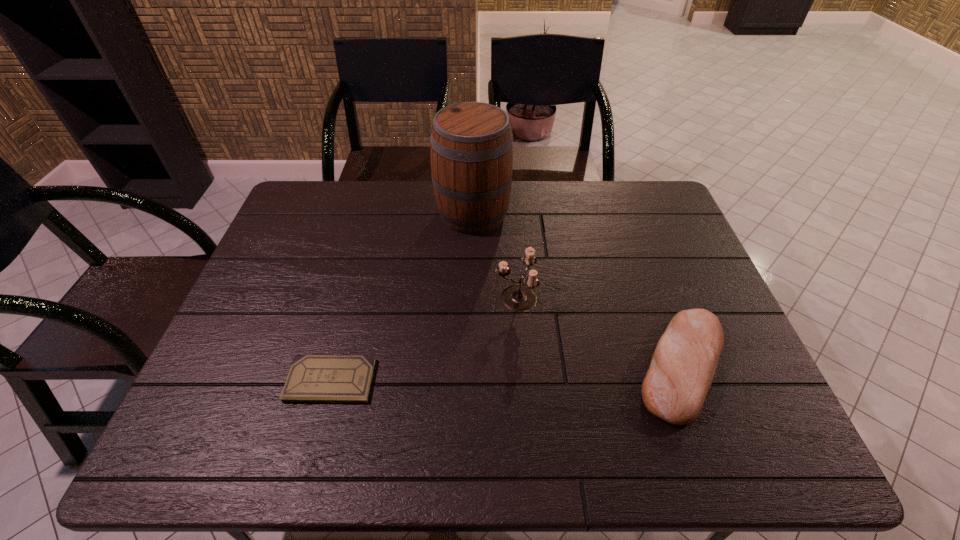
Find the location of a particular element. This screenshot has height=540, width=960. free space located on the back of the rightmost object is located at coordinates (655, 292).

I want to click on vacant space located 0.200m on the right of the leftmost object, so click(x=461, y=380).

Locate an element on the screen. object at the far edge is located at coordinates (471, 146).

At what (x,y) coordinates should I click in order to perform the action: click on object at the near edge. Please return your answer as a coordinate pair (x, y). Looking at the image, I should click on (683, 365).

You are a GUI agent. You are given a task and a screenshot of the screen. Output one action in this format:
    pyautogui.click(x=<x>, y=<y>)
    Task: Click on the object located at the right edge
    Image resolution: width=960 pixels, height=540 pixels.
    Given the screenshot: What is the action you would take?
    pyautogui.click(x=683, y=365)

Locate an element on the screen. The width and height of the screenshot is (960, 540). object that is at the near right corner is located at coordinates (683, 365).

Where is `vacant space at the far edge`? vacant space at the far edge is located at coordinates (565, 183).

Locate an element on the screen. free location at the left edge is located at coordinates (252, 415).

The image size is (960, 540). Find the location of `vacant space at the right edge of the desktop`. vacant space at the right edge of the desktop is located at coordinates (674, 245).

Where is `free space at the far right corner`? free space at the far right corner is located at coordinates (627, 217).